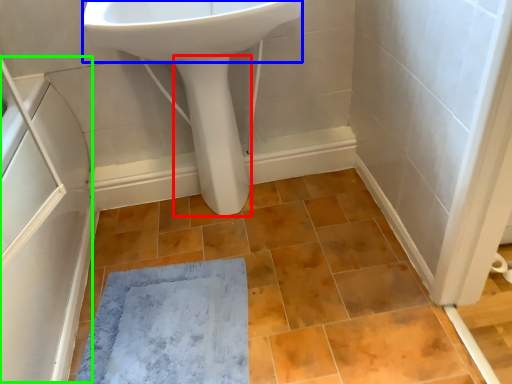
Question: Estimate the real-world distances between objects in this image. Which object is farther from bidet (highlighted by a red box), sink (highlighted by a blue box) or screen door (highlighted by a green box)?

Choices:
 (A) sink
 (B) screen door

Answer: (B)